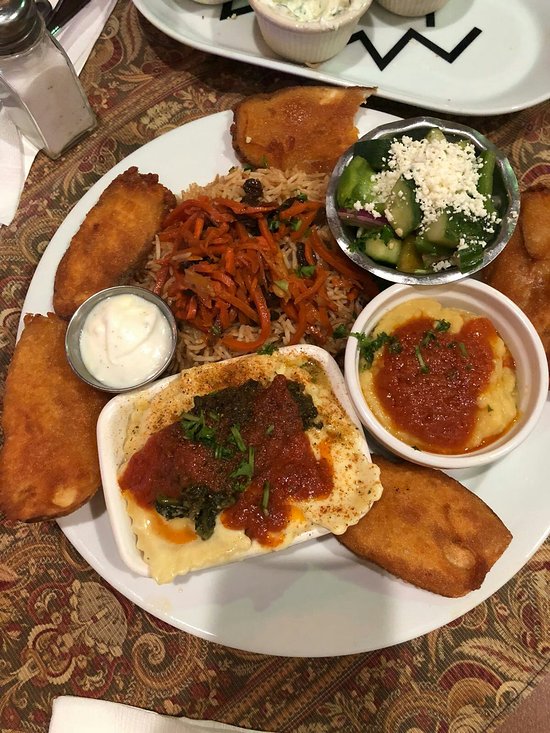
Image resolution: width=550 pixels, height=733 pixels. What are the coordinates of `napkin` in the screenshot? It's located at (74, 718).